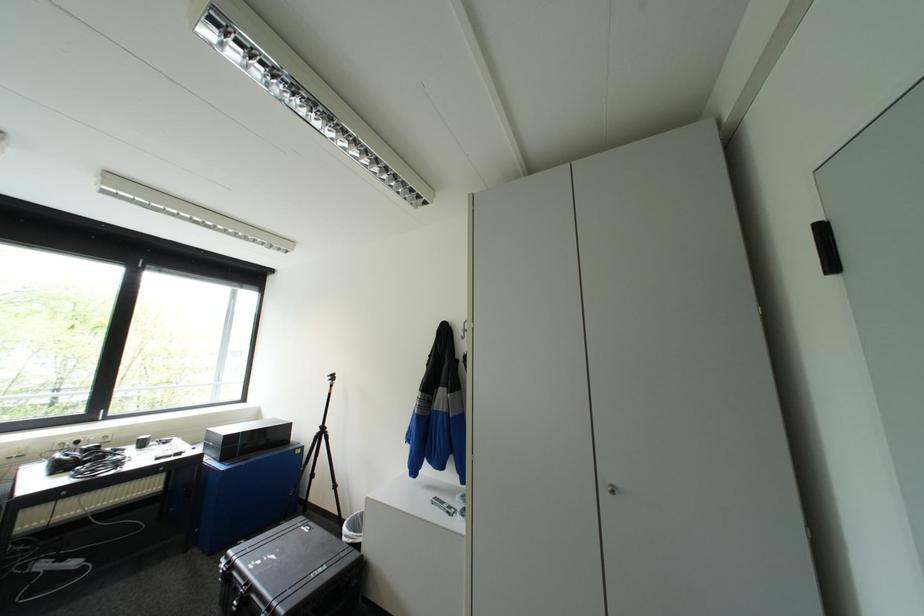
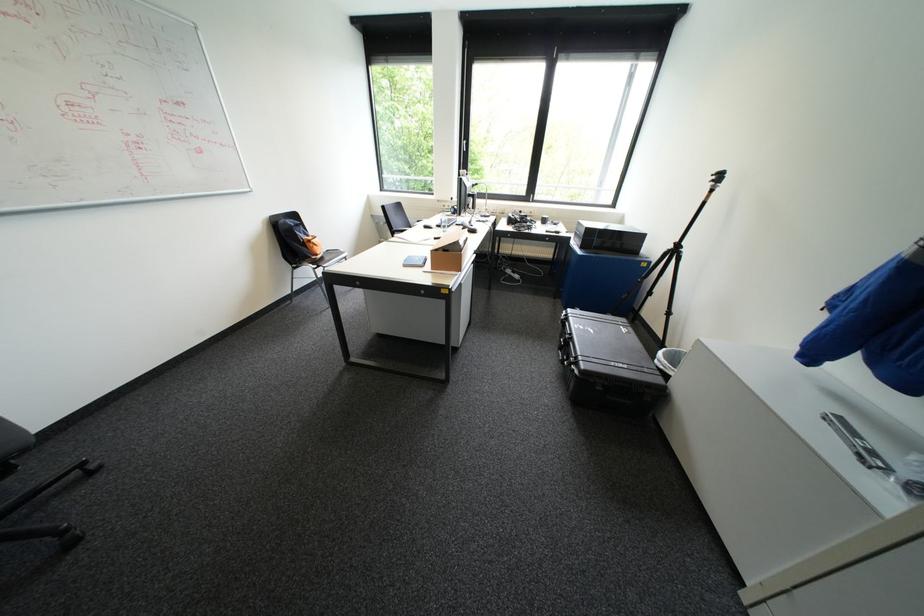
Find the pixel in the second image that matches the point at 361,554 in the first image.

(666, 379)